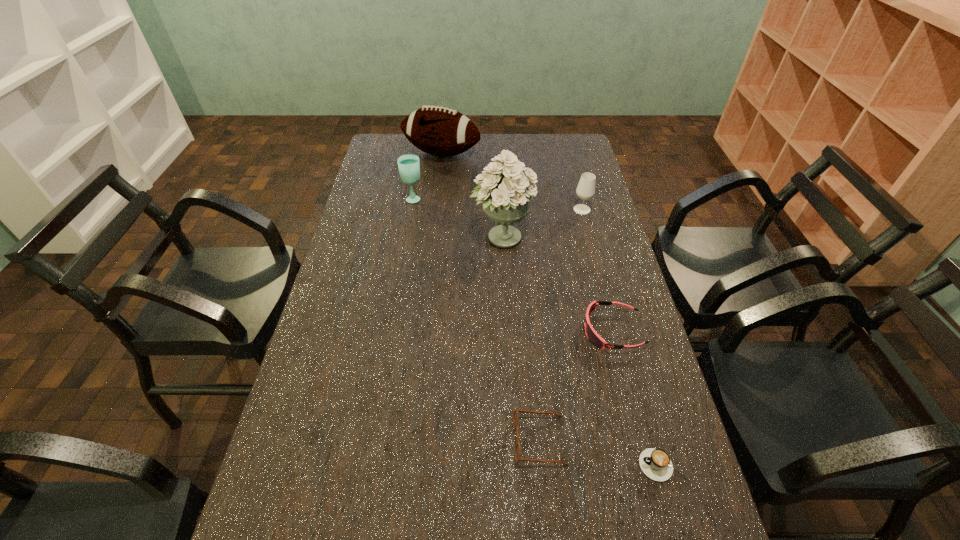
Locate an element on the screen. bouquet is located at coordinates (506, 198).

Where is `the fourth farthest object`? The width and height of the screenshot is (960, 540). the fourth farthest object is located at coordinates (506, 198).

Where is `football (American)`? This screenshot has width=960, height=540. football (American) is located at coordinates (440, 131).

This screenshot has height=540, width=960. What are the coordinates of `the sixth shortest object` in the screenshot? It's located at 440,131.

Where is `the taller glass`? the taller glass is located at coordinates tap(409, 167).

I want to click on the third tallest object, so click(x=409, y=167).

Image resolution: width=960 pixels, height=540 pixels. Find the location of `the shorter glass`. the shorter glass is located at coordinates (585, 190).

This screenshot has height=540, width=960. What are the coordinates of `the fourth tallest object` in the screenshot? It's located at (585, 190).

Locate an element on the screen. the third nearest object is located at coordinates (592, 335).

Image resolution: width=960 pixels, height=540 pixels. In order to click on the fifth tallest object in this screenshot , I will do `click(592, 335)`.